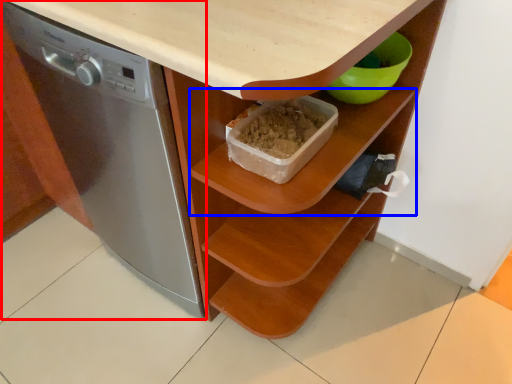
Question: Which point is further to the camera, home appliance (highlighted by a red box) or shelf (highlighted by a blue box)?

Choices:
 (A) home appliance
 (B) shelf

Answer: (B)